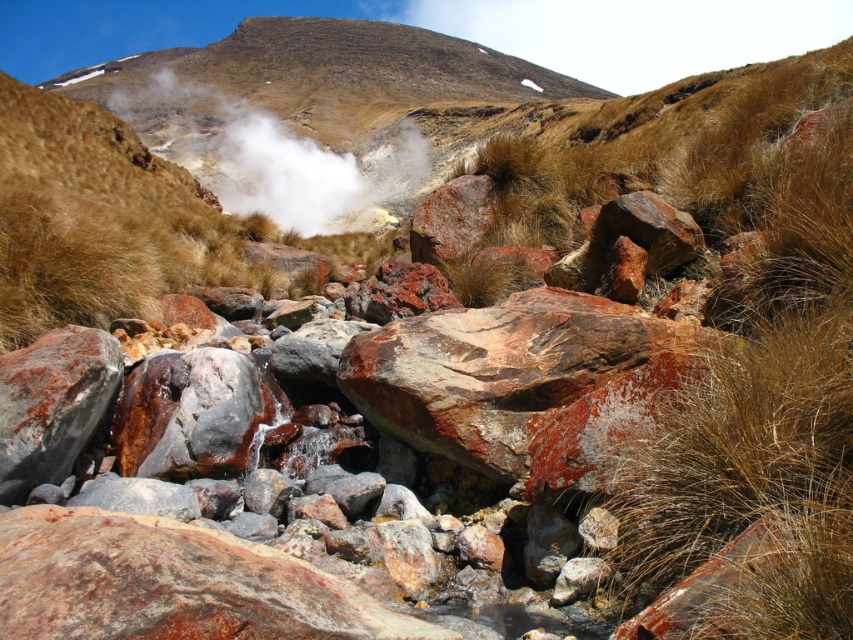
You are standing at the camera position observing the rugged landscape. There are two points marked in the image, point 1 at coordinates point [531,385] and point 2 at coordinates point [161,138]. Which point is closer to you?

Point [531,385] is closer to the camera than point [161,138].

You are a hiker trying to navigate through the rocky terrain. You see a rusty rock at center and a white vapor at center. Which object is taller? Please answer based on the scene description.

The white vapor at center is taller than the rusty rock at center.